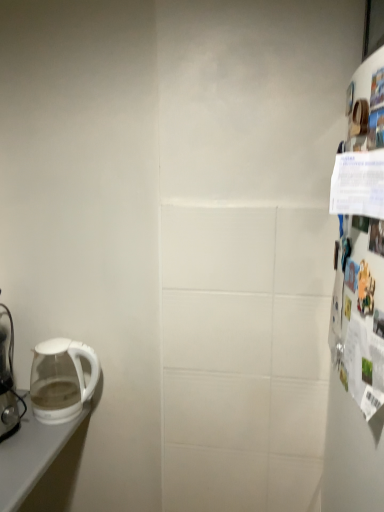
From the picture: Measure the distance between point [38,407] and camera.

The distance of point [38,407] from camera is 4.39 feet.

In order to click on transparent glass kettle at left in this screenshot , I will do `click(61, 379)`.

What is the approximate height of transparent glass kettle at left?

transparent glass kettle at left is 25.78 centimeters tall.

Describe the element at coordinates (61, 379) in the screenshot. I see `transparent glass kettle at left` at that location.

The height and width of the screenshot is (512, 384). What do you see at coordinates (8, 378) in the screenshot? I see `white glossy coffee maker at left` at bounding box center [8, 378].

Locate an element on the screen. This screenshot has width=384, height=512. white glossy coffee maker at left is located at coordinates coord(8,378).

What is the approximate height of white glossy coffee maker at left?

The height of white glossy coffee maker at left is 44.49 centimeters.

Locate an element on the screen. transparent glass kettle at left is located at coordinates (61, 379).

In the image, is transparent glass kettle at left on the left side or the right side of white glossy coffee maker at left?

In the image, transparent glass kettle at left appears on the right side of white glossy coffee maker at left.

Who is more distant, transparent glass kettle at left or white glossy coffee maker at left?

transparent glass kettle at left is more distant.

Is point (68, 386) positioned after point (6, 421)?

Yes.

From the image's perspective, is transparent glass kettle at left located above or below white glossy coffee maker at left?

transparent glass kettle at left is situated lower than white glossy coffee maker at left in the image.

From a real-world perspective, who is located higher, transparent glass kettle at left or white glossy coffee maker at left?

white glossy coffee maker at left.

Considering the sizes of transparent glass kettle at left and white glossy coffee maker at left in the image, is transparent glass kettle at left wider or thinner than white glossy coffee maker at left?

In the image, transparent glass kettle at left appears to be wider than white glossy coffee maker at left.

Is transparent glass kettle at left taller or shorter than white glossy coffee maker at left?

Clearly, transparent glass kettle at left is shorter compared to white glossy coffee maker at left.

Which of these two, transparent glass kettle at left or white glossy coffee maker at left, is smaller?

With smaller size is transparent glass kettle at left.

Is white glossy coffee maker at left a part of transparent glass kettle at left?

No, white glossy coffee maker at left is located outside of transparent glass kettle at left.

Is transparent glass kettle at left positioned far away from white glossy coffee maker at left?

No, transparent glass kettle at left is not far from white glossy coffee maker at left.

Is transparent glass kettle at left aimed at white glossy coffee maker at left?

No, transparent glass kettle at left is not oriented towards white glossy coffee maker at left.

The width and height of the screenshot is (384, 512). I want to click on coffee maker above the transparent glass kettle at left (from the image's perspective), so click(8, 378).

Which object is positioned more to the right, white glossy coffee maker at left or transparent glass kettle at left?

transparent glass kettle at left is more to the right.

Which object is more forward, white glossy coffee maker at left or transparent glass kettle at left?

white glossy coffee maker at left.

Is point (1, 371) positioned after point (72, 388)?

Yes, point (1, 371) is behind point (72, 388).

From the image's perspective, between white glossy coffee maker at left and transparent glass kettle at left, which one is located above?

white glossy coffee maker at left, from the image's perspective.

From a real-world perspective, which is physically below, white glossy coffee maker at left or transparent glass kettle at left?

transparent glass kettle at left, from a real-world perspective.

Which of these two, white glossy coffee maker at left or transparent glass kettle at left, is thinner?

white glossy coffee maker at left is thinner.

Can you confirm if white glossy coffee maker at left is taller than transparent glass kettle at left?

Indeed, white glossy coffee maker at left has a greater height compared to transparent glass kettle at left.

Considering the sizes of objects white glossy coffee maker at left and transparent glass kettle at left in the image provided, who is bigger, white glossy coffee maker at left or transparent glass kettle at left?

white glossy coffee maker at left.

Is white glossy coffee maker at left inside the boundaries of transparent glass kettle at left, or outside?

white glossy coffee maker at left is not inside transparent glass kettle at left, it's outside.

Is white glossy coffee maker at left positioned far away from transparent glass kettle at left?

That's not correct — white glossy coffee maker at left is a little close to transparent glass kettle at left.

Could you tell me if white glossy coffee maker at left is facing transparent glass kettle at left?

No, white glossy coffee maker at left is not facing towards transparent glass kettle at left.

How different are the orientations of white glossy coffee maker at left and transparent glass kettle at left in degrees?

The angle between the facing direction of white glossy coffee maker at left and the facing direction of transparent glass kettle at left is 5.53 degrees.

From the picture: How far apart are white glossy coffee maker at left and transparent glass kettle at left?

white glossy coffee maker at left is 5.16 inches away from transparent glass kettle at left.

The width and height of the screenshot is (384, 512). In order to click on kettle lying below the white glossy coffee maker at left (from the image's perspective) in this screenshot , I will do `click(61, 379)`.

Where is `kettle that is on the right side of white glossy coffee maker at left`? The image size is (384, 512). kettle that is on the right side of white glossy coffee maker at left is located at coordinates (61, 379).

Locate an element on the screen. This screenshot has height=512, width=384. coffee maker above the transparent glass kettle at left (from a real-world perspective) is located at coordinates point(8,378).